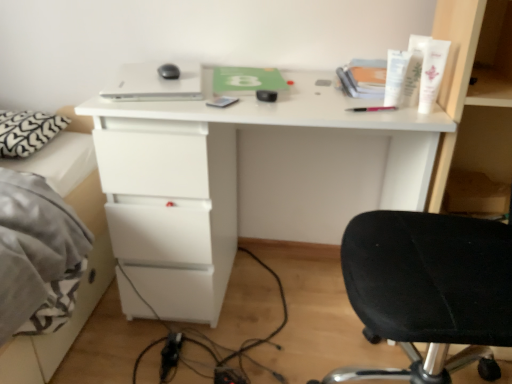
Where is `free spot behind matte gray notepad at center`? free spot behind matte gray notepad at center is located at coordinates (224, 92).